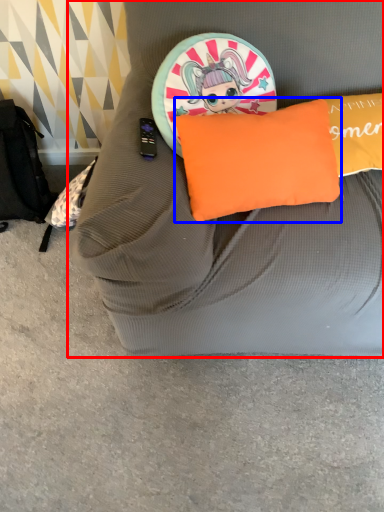
Question: Which object is further to the camera taking this photo, furniture (highlighted by a red box) or pillow (highlighted by a blue box)?

Choices:
 (A) furniture
 (B) pillow

Answer: (B)